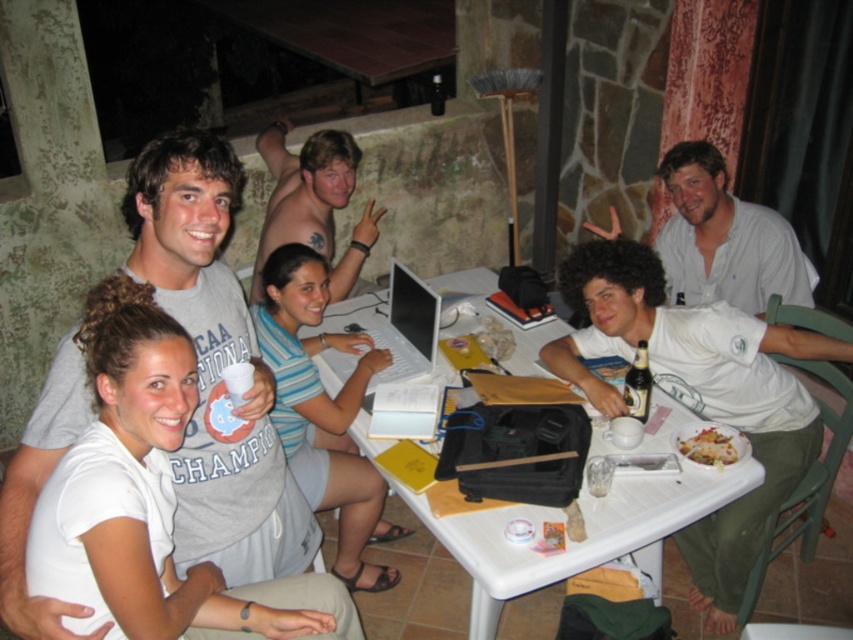
Question: Which point is closer to the camera taking this photo?

Choices:
 (A) (601, 330)
 (B) (148, 276)

Answer: (B)

Question: Is white cotton shirt at upper right to the left of white glossy plate at lower center from the viewer's perspective?

Choices:
 (A) no
 (B) yes

Answer: (A)

Question: Is the position of white cotton shirt at center less distant than that of white cotton shirt at upper right?

Choices:
 (A) yes
 (B) no

Answer: (A)

Question: Among these points, which one is nearest to the camera?

Choices:
 (A) (282, 182)
 (B) (726, 442)
 (C) (643, 344)

Answer: (B)

Question: Does white glossy plate at lower center lie behind brown glass bottle at center?

Choices:
 (A) no
 (B) yes

Answer: (A)

Question: Which object is positioned farthest from the shiny brown hair at center?

Choices:
 (A) brown glass bottle at center
 (B) white plastic table at center
 (C) white glossy plate at lower center

Answer: (C)